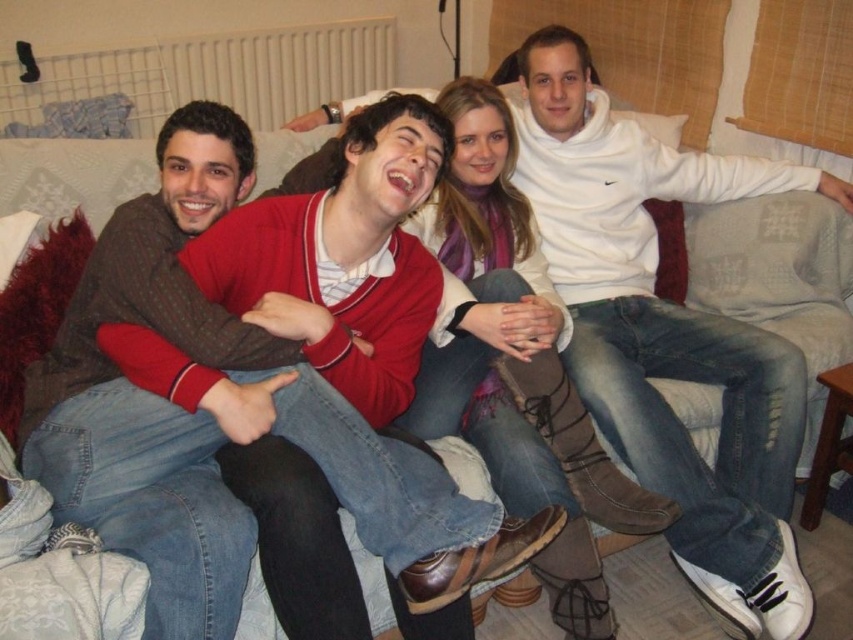
You are a photographer setting up a shoot in the living room. You need to adjust the lighting so that the matte red sweater at center and the brown leather boots at center are both well lit. Based on their positions, which object should you focus the light on first to ensure both are properly illuminated?

The matte red sweater at center is located below brown leather boots at center. Since the sweater is lower, you should focus the light on the brown leather boots at center first to ensure the lower positioned sweater also gets adequate lighting.

In the scene shown: You are a tailor measuring the distance between the matte red sweater at center and the brown leather boots at center for a custom fitting. Given that the minimum required space for proper measurement is 10 inches, can you proceed with the measurement?

The distance between the matte red sweater at center and the brown leather boots at center is 10.64 inches, which exceeds the minimum requirement of 10 inches. Therefore, you can proceed with the measurement.